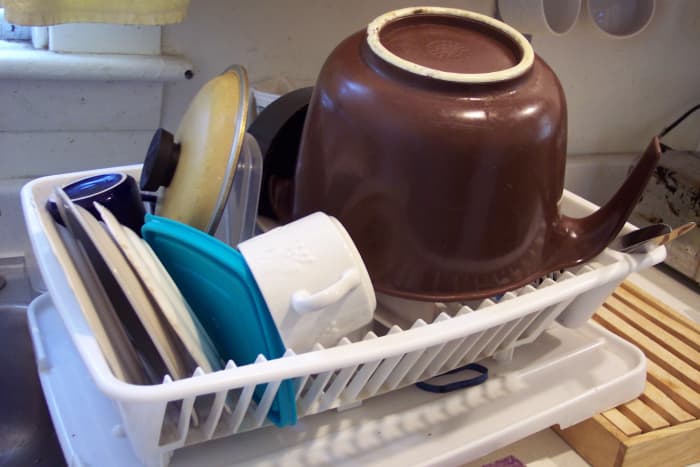
Locate an element on the screen. sink to the left of the drying rack is located at coordinates (15, 392).